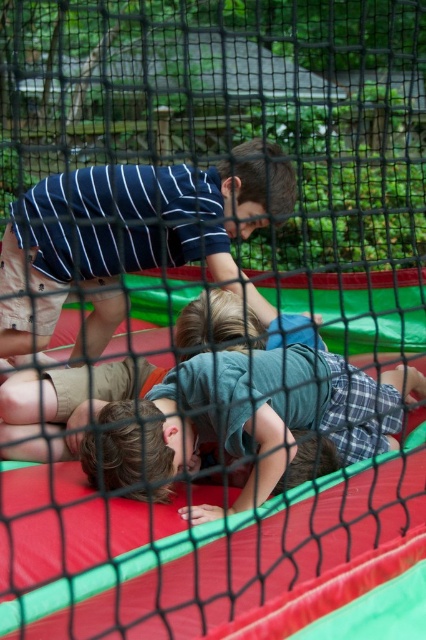
You are standing in front of the trampoline and see a point at coordinates (250, 420). What object is this point located on?

The point at coordinates (250, 420) is located on the green cotton shirt at center.

You are a photographer trying to capture the children on the trampoline. You notice two shirts, the green cotton shirt at center and the striped cotton shirt at upper center. Which shirt is located to the right of the other?

The green cotton shirt at center is positioned on the right side of striped cotton shirt at upper center.

You are a parent supervising children on the trampoline. You notice two shirts on the trampoline surface. Which shirt is smaller in size between the green cotton shirt at center and the striped cotton shirt at upper center?

The green cotton shirt at center is smaller in size compared to the striped cotton shirt at upper center.